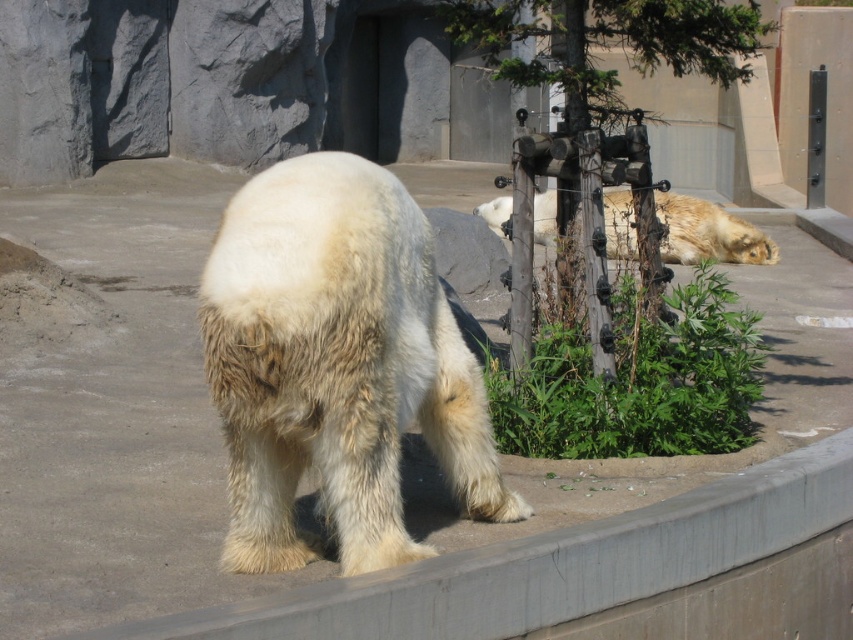
Question: Can you confirm if white fluffy bear at center is wider than fuzzy golden bear at center?

Choices:
 (A) no
 (B) yes

Answer: (B)

Question: Does white fluffy bear at center come behind gray concrete ledge at lower center?

Choices:
 (A) yes
 (B) no

Answer: (A)

Question: Does white fluffy bear at center lie in front of fuzzy golden bear at center?

Choices:
 (A) no
 (B) yes

Answer: (B)

Question: Which object appears closest to the camera in this image?

Choices:
 (A) white fluffy bear at center
 (B) fuzzy golden bear at center

Answer: (A)

Question: Among these objects, which one is farthest from the camera?

Choices:
 (A) fuzzy golden bear at center
 (B) gray concrete ledge at lower center
 (C) white fluffy bear at center

Answer: (A)

Question: Which of the following is the farthest from the observer?

Choices:
 (A) (605, 236)
 (B) (843, 605)

Answer: (A)